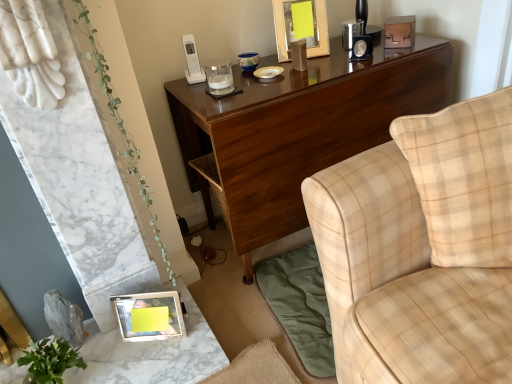
Question: From the image's perspective, is metallic silver frame at lower left below metallic silver photo frame at lower left, the first picture frame viewed from the left?

Choices:
 (A) no
 (B) yes

Answer: (B)

Question: From the image's perspective, is metallic silver frame at lower left over metallic silver photo frame at lower left, which ranks as the 2th picture frame in right-to-left order?

Choices:
 (A) no
 (B) yes

Answer: (A)

Question: From a real-world perspective, is metallic silver frame at lower left over metallic silver photo frame at lower left, positioned as the second picture frame in top-to-bottom order?

Choices:
 (A) no
 (B) yes

Answer: (A)

Question: Is metallic silver frame at lower left oriented away from metallic silver photo frame at lower left, positioned as the second picture frame in top-to-bottom order?

Choices:
 (A) no
 (B) yes

Answer: (A)

Question: Is metallic silver frame at lower left in contact with metallic silver photo frame at lower left, the first picture frame viewed from the left?

Choices:
 (A) yes
 (B) no

Answer: (A)

Question: From a real-world perspective, is metallic silver photo frame at lower left, acting as the 2th picture frame starting from the back, physically located above or below beige plaid fabric couch at upper right?

Choices:
 (A) below
 (B) above

Answer: (A)

Question: From the image's perspective, relative to beige plaid fabric couch at upper right, is metallic silver photo frame at lower left, acting as the 2th picture frame starting from the back, above or below?

Choices:
 (A) above
 (B) below

Answer: (B)

Question: Is point (121, 297) closer or farther from the camera than point (428, 223)?

Choices:
 (A) closer
 (B) farther

Answer: (B)

Question: Relative to beige plaid fabric couch at upper right, is metallic silver photo frame at lower left, positioned as the second picture frame in top-to-bottom order, in front or behind?

Choices:
 (A) front
 (B) behind

Answer: (B)

Question: From the image's perspective, is metallic silver photo frame at lower left, which ranks as the 2th picture frame in right-to-left order, positioned above or below metallic silver frame at lower left?

Choices:
 (A) above
 (B) below

Answer: (A)

Question: In terms of width, does metallic silver photo frame at lower left, the 1th picture frame viewed from the front, look wider or thinner when compared to metallic silver frame at lower left?

Choices:
 (A) thin
 (B) wide

Answer: (A)

Question: Is metallic silver photo frame at lower left, acting as the 2th picture frame starting from the back, bigger or smaller than metallic silver frame at lower left?

Choices:
 (A) big
 (B) small

Answer: (B)

Question: Would you say metallic silver photo frame at lower left, acting as the first picture frame starting from the bottom, is inside or outside metallic silver frame at lower left?

Choices:
 (A) inside
 (B) outside

Answer: (B)

Question: Is glossy wood desk at upper center inside the boundaries of yellow paper at upper center, the first picture frame from the right, or outside?

Choices:
 (A) outside
 (B) inside

Answer: (A)

Question: In the image, is glossy wood desk at upper center positioned in front of or behind yellow paper at upper center, the first picture frame from the right?

Choices:
 (A) behind
 (B) front

Answer: (B)